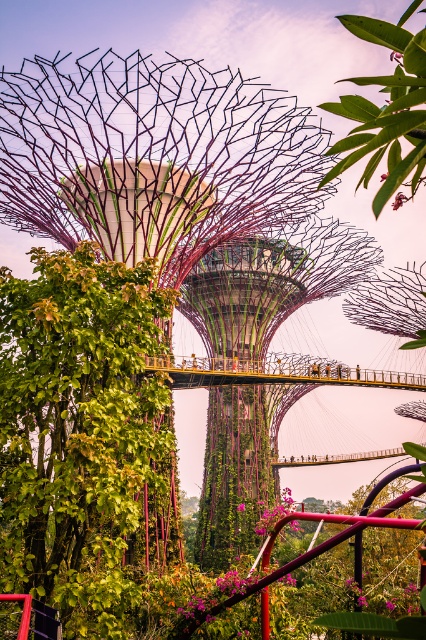
Does green textured tower at center have a lesser width compared to green leafy tree at upper center?

Incorrect, green textured tower at center's width is not less than green leafy tree at upper center's.

Does green textured tower at center appear on the right side of green leafy tree at upper center?

Incorrect, green textured tower at center is not on the right side of green leafy tree at upper center.

Locate an element on the screen. green textured tower at center is located at coordinates (249, 291).

Where is `green textured tower at center`? The width and height of the screenshot is (426, 640). green textured tower at center is located at coordinates (249, 291).

Can you confirm if green leafy plant at left is positioned to the left of green textured tower at center?

Yes, green leafy plant at left is to the left of green textured tower at center.

What are the coordinates of `green leafy plant at left` in the screenshot? It's located at (83, 436).

The height and width of the screenshot is (640, 426). I want to click on green leafy plant at left, so click(x=83, y=436).

What are the coordinates of `green leafy plant at left` in the screenshot? It's located at (83, 436).

Image resolution: width=426 pixels, height=640 pixels. Describe the element at coordinates (83, 436) in the screenshot. I see `green leafy plant at left` at that location.

Where is `green leafy plant at left`? The image size is (426, 640). green leafy plant at left is located at coordinates (83, 436).